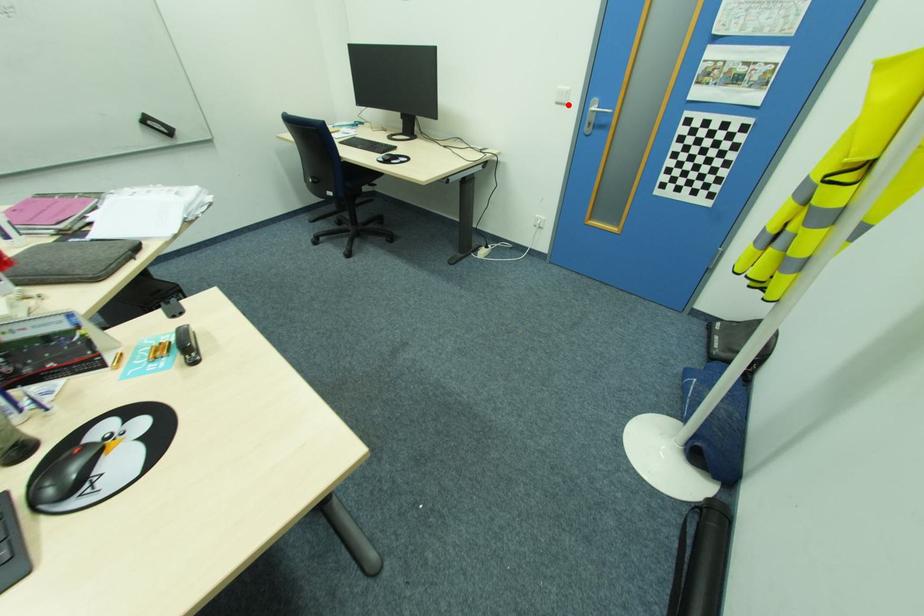
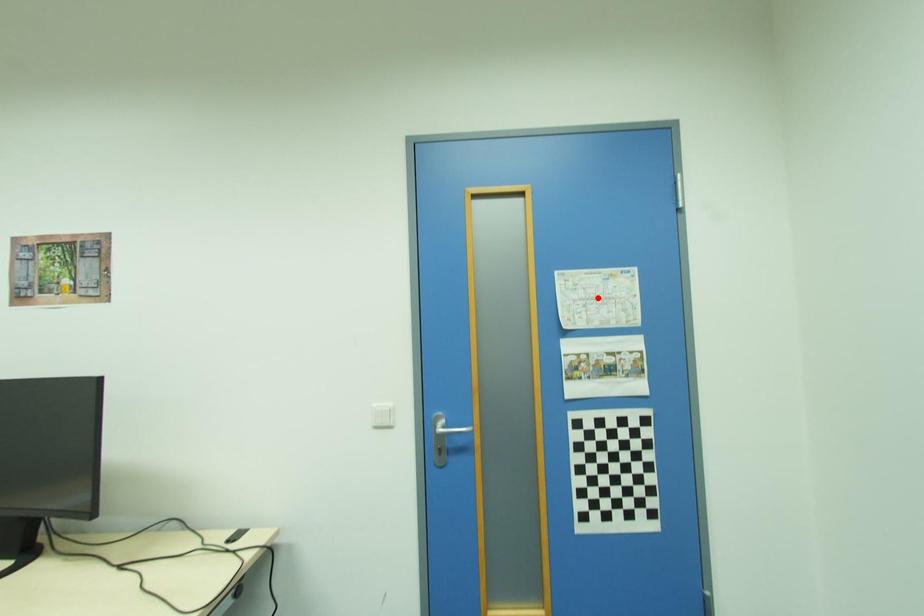
I am providing you with two images of the same scene from different viewpoints. A red point is marked on the first image and another point is marked on the second image. Is the marked point in image1 the same physical position as the marked point in image2?

No